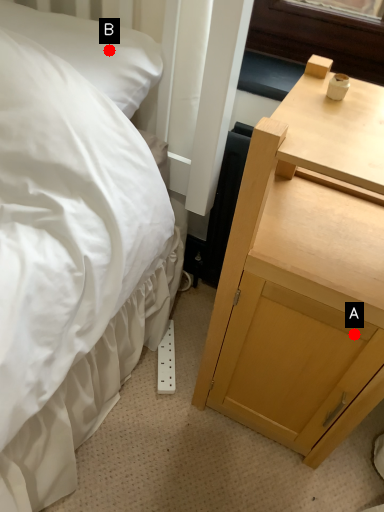
Question: Two points are circled on the image, labeled by A and B beside each circle. Which point is farther from the camera taking this photo?

Choices:
 (A) A is further
 (B) B is further

Answer: (B)